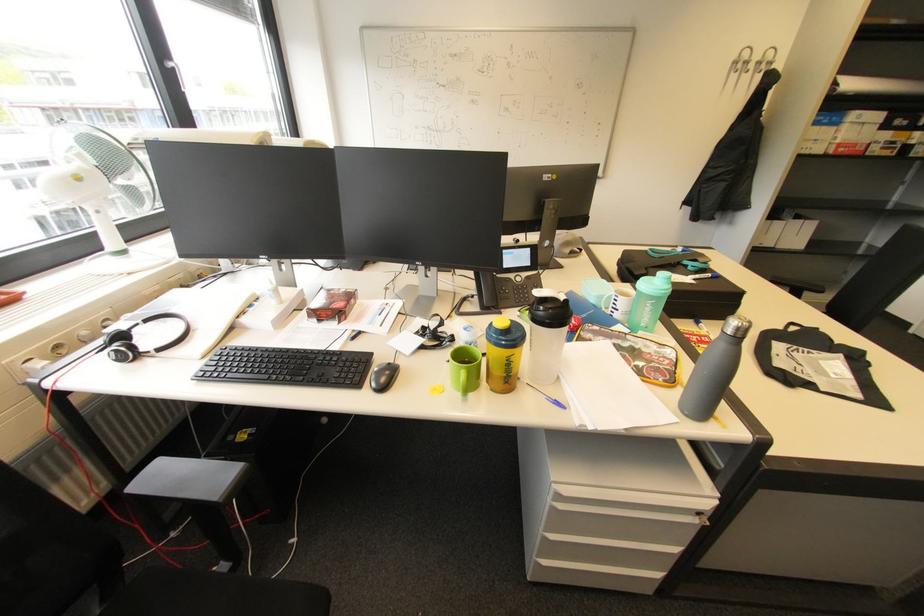
Describe the element at coordinates (502, 323) in the screenshot. I see `the yellow bottle lid` at that location.